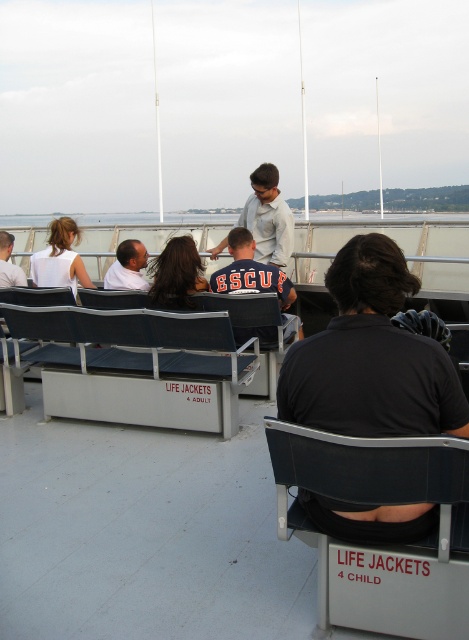
Question: Observing the image, what is the correct spatial positioning of black fabric shirt at center in reference to white matte shirt at left?

Choices:
 (A) below
 (B) above

Answer: (A)

Question: Considering the real-world distances, which object is farthest from the dark blue jersey at center?

Choices:
 (A) white matte shirt at left
 (B) light gray shirt at center
 (C) black fabric shirt at center

Answer: (C)

Question: Which point is farther to the camera?

Choices:
 (A) (266, 264)
 (B) (421, 490)

Answer: (A)

Question: Based on their relative distances, which object is nearer to the matte black chair at center?

Choices:
 (A) light brown leather jacket at center
 (B) light gray shirt at center
 (C) dark blue jersey at center

Answer: (C)

Question: Is black fabric shirt at center in front of matte black chair at center?

Choices:
 (A) yes
 (B) no

Answer: (A)

Question: Considering the relative positions of dark blue jersey at center and white matte shirt at left in the image provided, where is dark blue jersey at center located with respect to white matte shirt at left?

Choices:
 (A) left
 (B) right

Answer: (B)